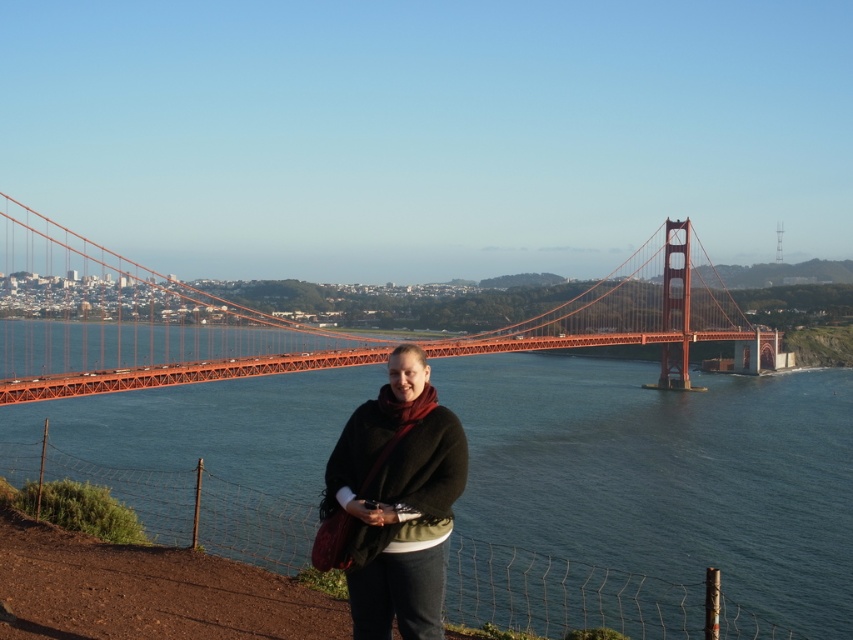
You are standing on the dirt path near the edge of the frame and want to take a photo of the Golden Gate Bridge. To ensure the glossy water at center is in the foreground of your photo, where should you position yourself relative to the water?

The glossy water at center is located at point (648, 496), so you should position yourself closer to the water to have it in the foreground of your photo.

You are a photographer standing on the dirt path near the edge of the frame. You want to capture a photo where the glossy water at center is in focus while keeping the orange painted steel golden gate bridge at center in the background. Is this possible?

Yes, because the glossy water at center is closer to the viewer than the orange painted steel golden gate bridge at center, so you can focus on the water and have the bridge in the background.